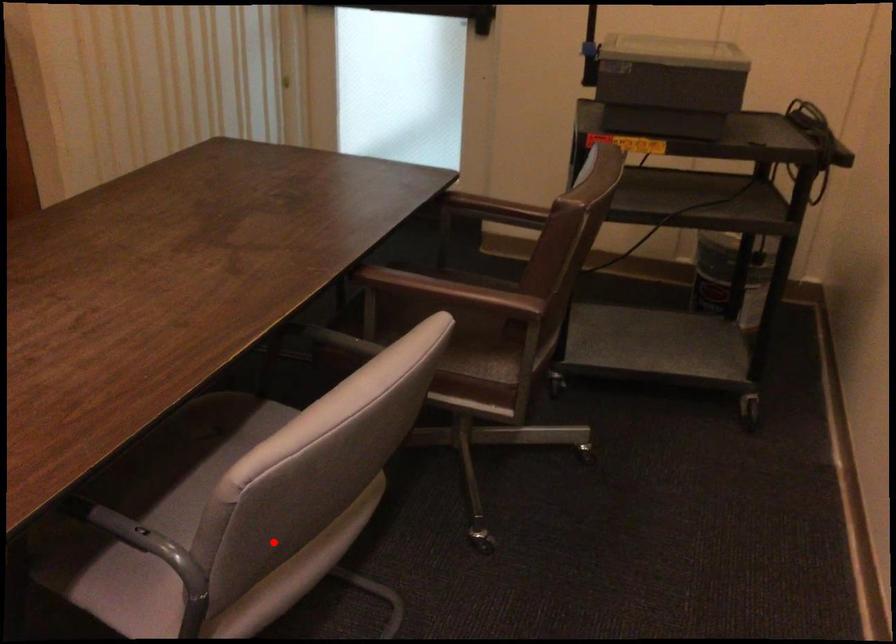
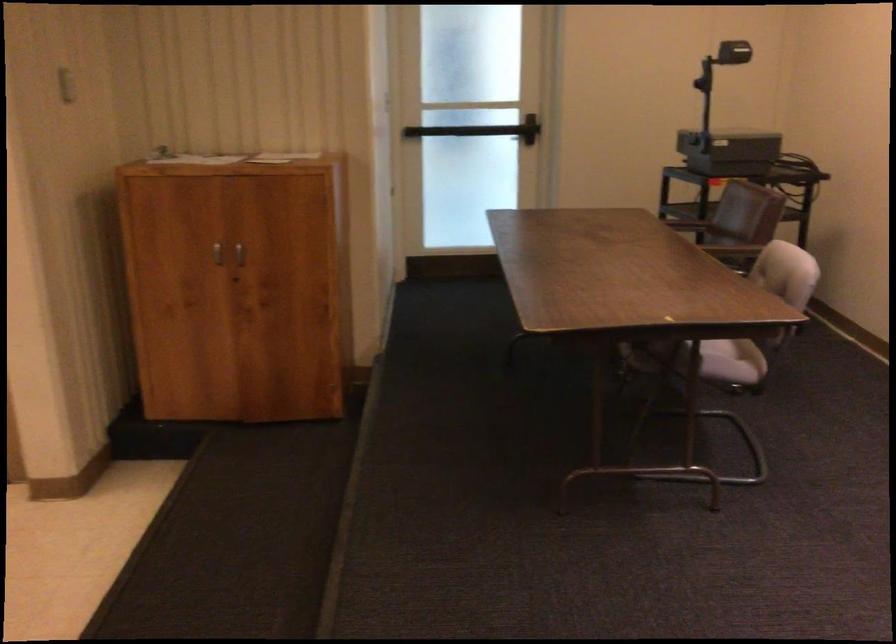
Question: A red point is marked in image1. In image2, is the corresponding 3D point closer to the camera or farther? Reply with the corresponding letter.

Choices:
 (A) The corresponding 3D point is closer.
 (B) The corresponding 3D point is farther.

Answer: (B)